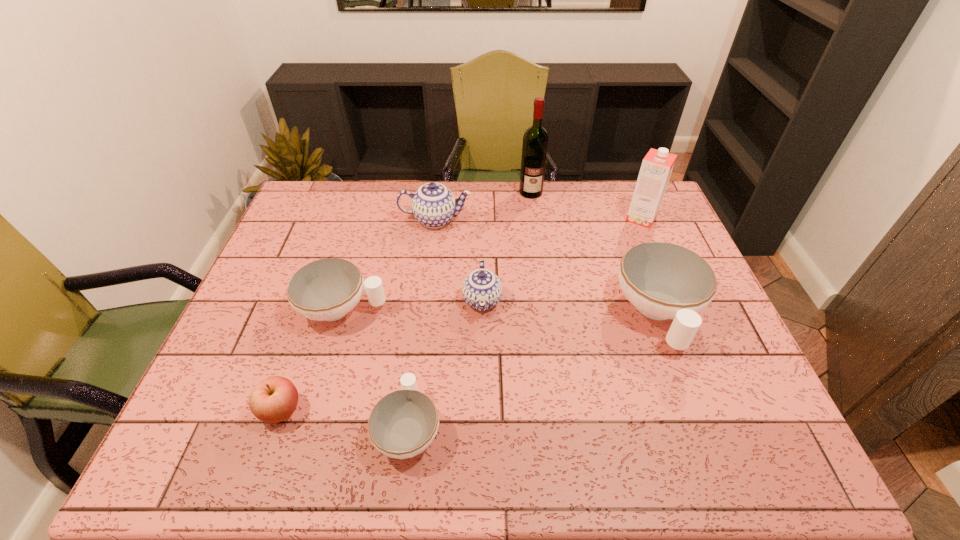
I want to click on free space located 0.130m on the side with the handle of the second white chinaware from right to left, so click(x=419, y=345).

Where is `vacant region located on the side with the handle of the second white chinaware from right to left`? The height and width of the screenshot is (540, 960). vacant region located on the side with the handle of the second white chinaware from right to left is located at coordinates (419, 342).

The height and width of the screenshot is (540, 960). What are the coordinates of `alcohol present at the far edge` in the screenshot? It's located at (535, 140).

You are a GUI agent. You are given a task and a screenshot of the screen. Output one action in this format:
    pyautogui.click(x=<x>, y=<y>)
    Task: Click on the carton that is positioned at the far edge
    The height and width of the screenshot is (540, 960).
    Given the screenshot: What is the action you would take?
    pyautogui.click(x=657, y=165)

Find the location of a particular element. chinaware at the far edge is located at coordinates (433, 205).

The height and width of the screenshot is (540, 960). In order to click on apple that is at the near edge in this screenshot , I will do `click(273, 400)`.

Where is `chinaware situated at the near edge`? chinaware situated at the near edge is located at coordinates (402, 424).

At what (x,y) coordinates should I click in order to perform the action: click on chinaware present at the left edge. Please return your answer as a coordinate pair (x, y). This screenshot has width=960, height=540. Looking at the image, I should click on click(327, 289).

Image resolution: width=960 pixels, height=540 pixels. Identify the location of apple located at the left edge. [x=273, y=400].

This screenshot has width=960, height=540. Identify the location of carton that is at the right edge. (657, 165).